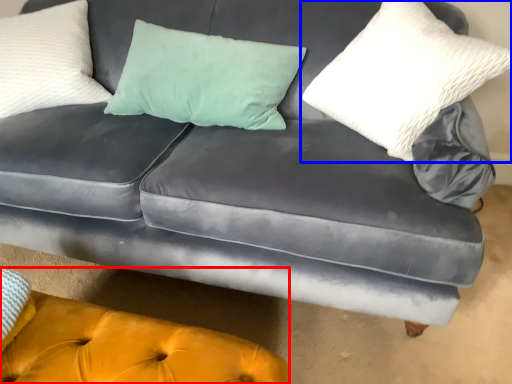
Question: Which object appears farthest to the camera in this image, couch (highlighted by a red box) or pillow (highlighted by a blue box)?

Choices:
 (A) couch
 (B) pillow

Answer: (B)